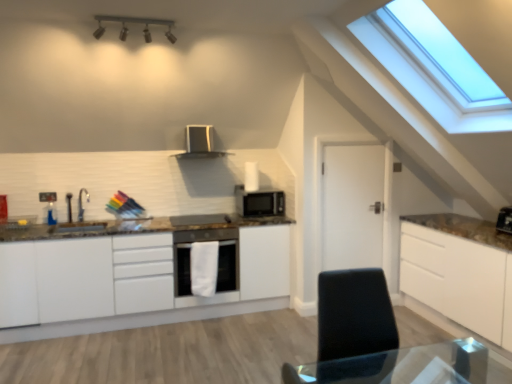
The image size is (512, 384). Find the location of `empty space that is ontop of white matte door at center (from a real-world perspective)`. empty space that is ontop of white matte door at center (from a real-world perspective) is located at coordinates (350, 139).